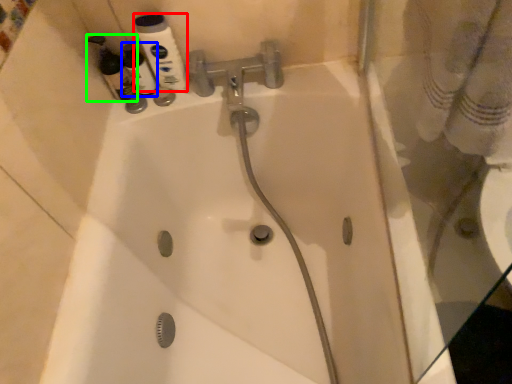
Question: Which object is the farthest from mouthwash (highlighted by a red box)? Choose among these: cleaning product (highlighted by a blue box) or cleaning product (highlighted by a green box).

Choices:
 (A) cleaning product
 (B) cleaning product

Answer: (B)